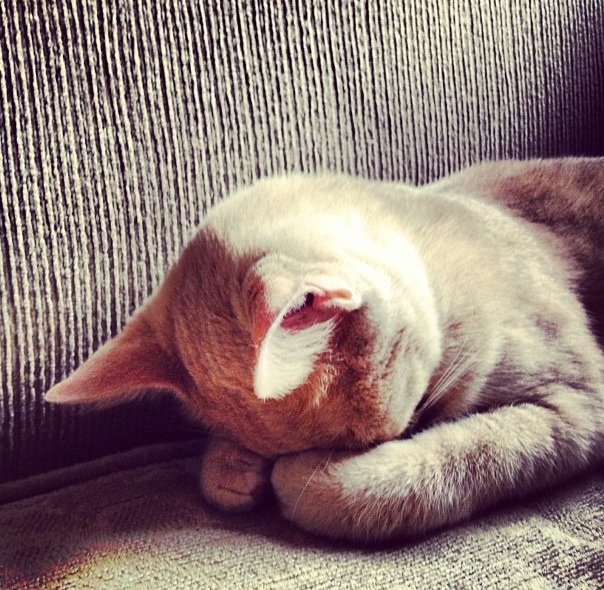
You are a GUI agent. You are given a task and a screenshot of the screen. Output one action in this format:
    pyautogui.click(x=<x>, y=<y>)
    Task: Click on the couch back
    
    Given the screenshot: What is the action you would take?
    pyautogui.click(x=176, y=132)